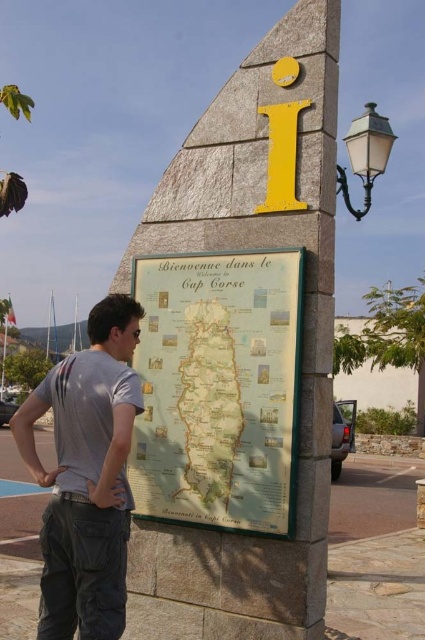
You are standing at the information kiosk with the yellow i symbol. You notice two points marked on the map titled Bienvenue dans le Cap Corse. The first point is at coordinates point (144, 497) and the second is at point (81, 422). If you were to walk towards the structure, which point would you reach first?

Point (81, 422) would be reached first because it is closer to the viewer than point (144, 497), which is further away.